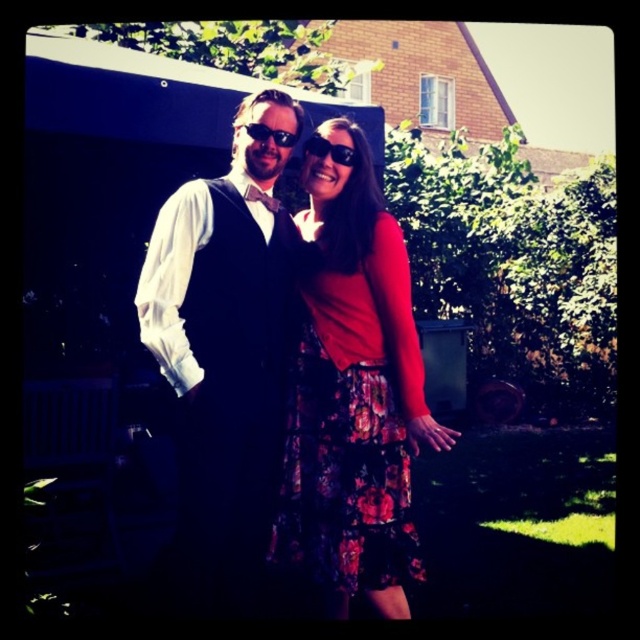
Is point (323, 140) more distant than point (252, 134)?

Yes, it is behind point (252, 134).

What are the coordinates of `sunglasses at center` in the screenshot? It's located at (328, 150).

Is matte black vest at center thinner than black plastic sunglasses at center?

Incorrect, matte black vest at center's width is not less than black plastic sunglasses at center's.

Consider the image. Between matte black vest at center and black plastic sunglasses at center, which one has less height?

black plastic sunglasses at center

Is point (250, 276) behind point (282, 141)?

That is False.

The width and height of the screenshot is (640, 640). Identify the location of matte black vest at center. (225, 349).

Who is higher up, floral skirt at center or black plastic sunglasses at center?

Positioned higher is black plastic sunglasses at center.

Who is taller, floral skirt at center or black plastic sunglasses at center?

With more height is floral skirt at center.

Identify the location of floral skirt at center. The image size is (640, 640). (353, 396).

Locate an element on the screen. floral skirt at center is located at coordinates (353, 396).